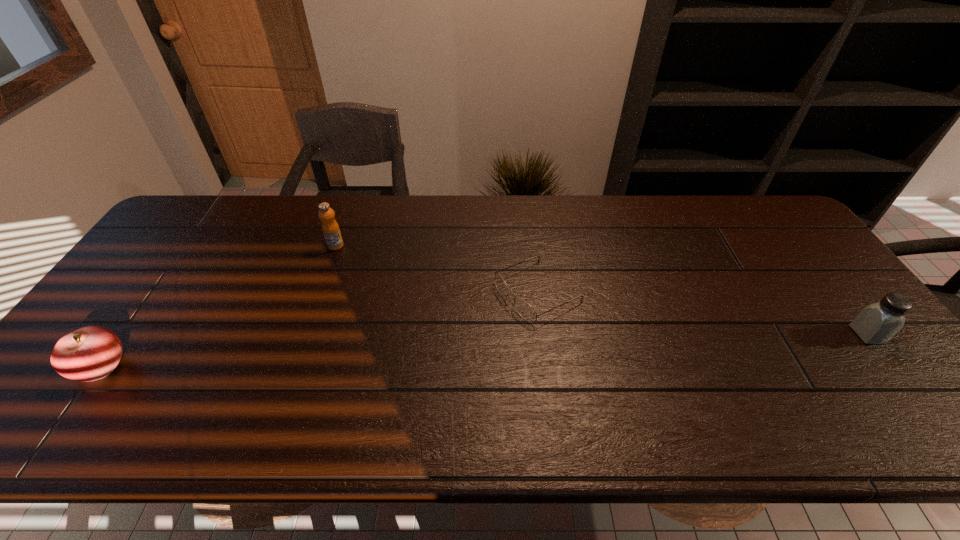
At what (x,y) coordinates should I click in order to perform the action: click on free space on the desktop that is between the leftmost object and the rightmost object and is positioned on the front-facing side of the shortest object. Please return your answer as a coordinate pair (x, y). Image resolution: width=960 pixels, height=540 pixels. Looking at the image, I should click on (417, 353).

The height and width of the screenshot is (540, 960). I want to click on free spot on the desktop that is between the apple and the saltshaker and is positioned on the front label of the farthest object, so click(539, 347).